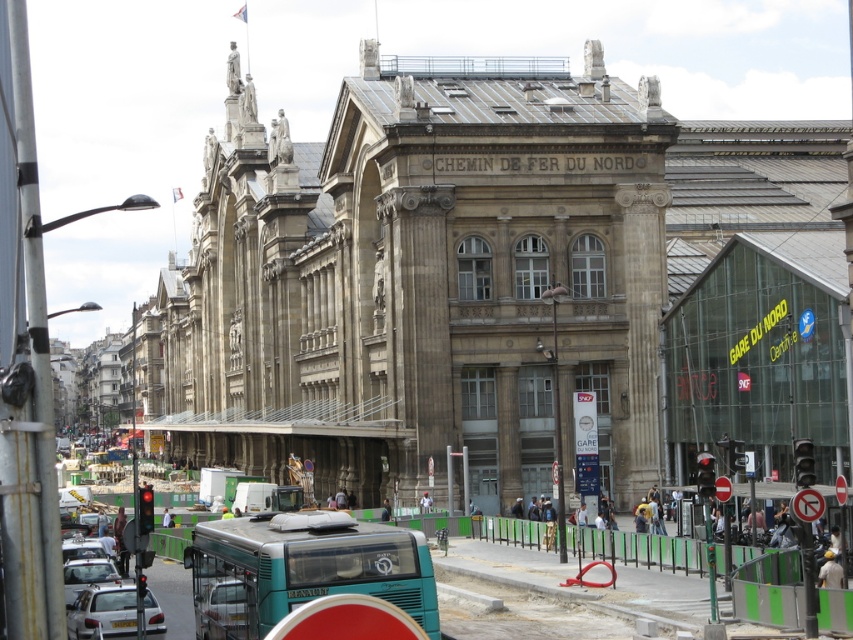
Question: Which point is farther to the camera?

Choices:
 (A) matte silver car at lower left
 (B) silver metallic sedan at lower left

Answer: (A)

Question: Does silver metallic car at lower left have a greater width compared to matte silver car at lower left?

Choices:
 (A) no
 (B) yes

Answer: (B)

Question: Can you confirm if silver metallic sedan at lower left is bigger than silver metallic car at lower left?

Choices:
 (A) yes
 (B) no

Answer: (B)

Question: Which of the following is the farthest from the observer?

Choices:
 (A) (62, 570)
 (B) (148, 611)

Answer: (A)

Question: Can you confirm if silver metallic car at lower left is positioned below matte silver car at lower left?

Choices:
 (A) no
 (B) yes

Answer: (A)

Question: Which point is farther to the camera?

Choices:
 (A) silver metallic car at lower left
 (B) silver metallic sedan at lower left

Answer: (B)